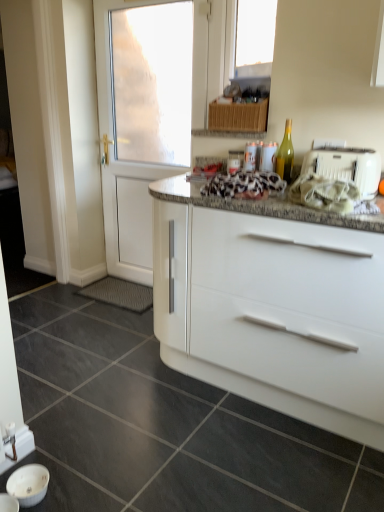
Find the location of a particular element. This screenshot has height=512, width=384. unoccupied area in front of white glossy door at left is located at coordinates (109, 323).